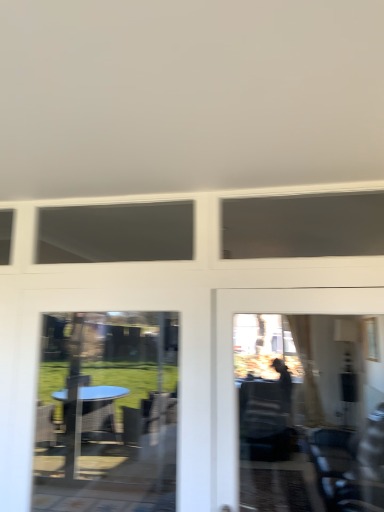
Question: Can you confirm if transparent glass table at lower left is shorter than matte glass door at right?

Choices:
 (A) no
 (B) yes

Answer: (A)

Question: Does transparent glass table at lower left have a larger size compared to matte glass door at right?

Choices:
 (A) yes
 (B) no

Answer: (B)

Question: Is transparent glass table at lower left at the left side of matte glass door at right?

Choices:
 (A) no
 (B) yes

Answer: (B)

Question: From a real-world perspective, is transparent glass table at lower left over matte glass door at right?

Choices:
 (A) no
 (B) yes

Answer: (A)

Question: Considering the relative positions of transparent glass table at lower left and matte glass door at right in the image provided, is transparent glass table at lower left behind matte glass door at right?

Choices:
 (A) yes
 (B) no

Answer: (A)

Question: From the image's perspective, does transparent glass table at lower left appear lower than matte glass door at right?

Choices:
 (A) yes
 (B) no

Answer: (A)

Question: Is matte glass door at right wider than transparent glass table at lower left?

Choices:
 (A) no
 (B) yes

Answer: (B)

Question: Considering the relative positions of matte glass door at right and transparent glass table at lower left in the image provided, is matte glass door at right to the left of transparent glass table at lower left from the viewer's perspective?

Choices:
 (A) no
 (B) yes

Answer: (A)

Question: From a real-world perspective, does matte glass door at right sit lower than transparent glass table at lower left?

Choices:
 (A) yes
 (B) no

Answer: (B)

Question: From the image's perspective, is matte glass door at right below transparent glass table at lower left?

Choices:
 (A) yes
 (B) no

Answer: (B)

Question: From the image's perspective, would you say matte glass door at right is positioned over transparent glass table at lower left?

Choices:
 (A) yes
 (B) no

Answer: (A)

Question: Is matte glass door at right oriented away from transparent glass table at lower left?

Choices:
 (A) yes
 (B) no

Answer: (B)

Question: In terms of height, does transparent glass table at lower left look taller or shorter compared to matte glass door at right?

Choices:
 (A) short
 (B) tall

Answer: (B)